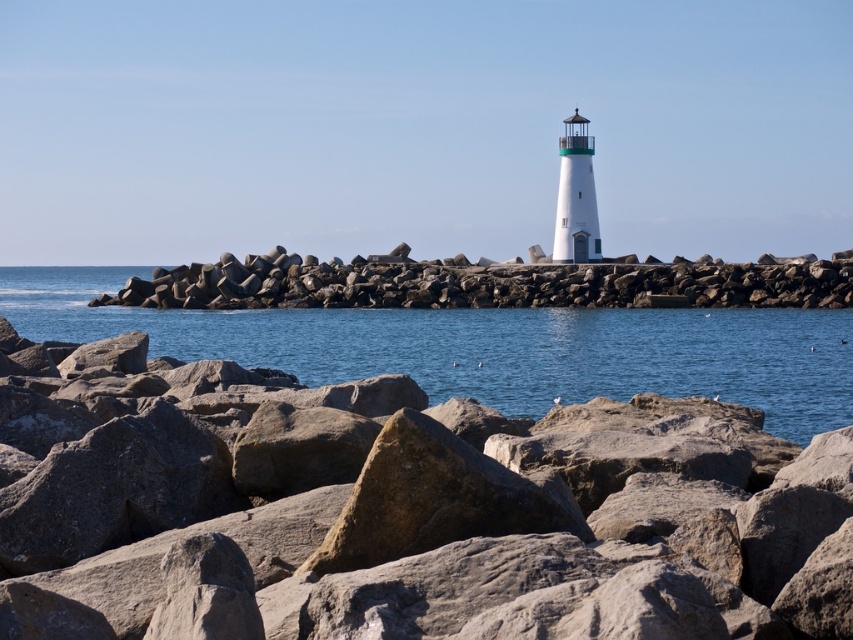
Question: Which point appears closest to the camera in this image?

Choices:
 (A) (183, 324)
 (B) (492, 291)

Answer: (A)

Question: Can you confirm if blue water at center is positioned to the left of rockyroughrocks at center?

Choices:
 (A) yes
 (B) no

Answer: (A)

Question: Which is farther from the gray rock at center?

Choices:
 (A) rockyroughrocks at center
 (B) blue water at center

Answer: (A)

Question: Is gray rock at center positioned before rockyroughrocks at center?

Choices:
 (A) no
 (B) yes

Answer: (B)

Question: Which object is positioned closest to the gray rock at center?

Choices:
 (A) rockyroughrocks at center
 (B) blue water at center

Answer: (B)

Question: Is blue water at center positioned in front of rockyroughrocks at center?

Choices:
 (A) yes
 (B) no

Answer: (A)